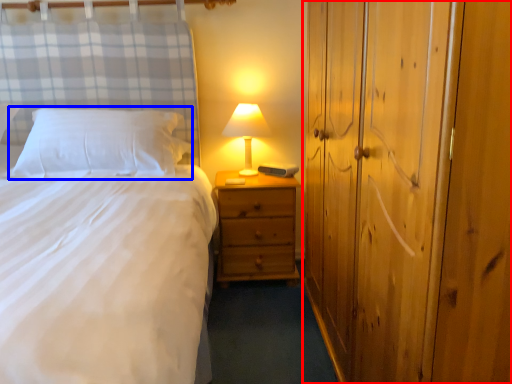
Question: Which object appears farthest to the camera in this image, dresser (highlighted by a red box) or pillow (highlighted by a blue box)?

Choices:
 (A) dresser
 (B) pillow

Answer: (B)